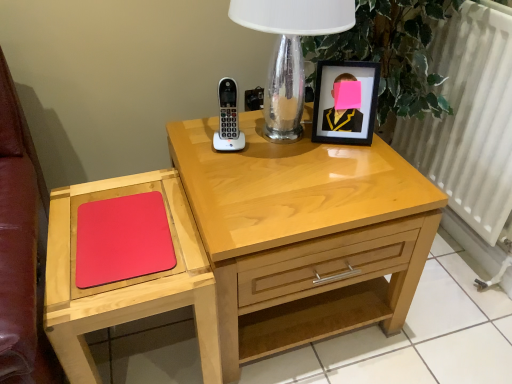
The width and height of the screenshot is (512, 384). In order to click on vacant space positioned to the left of white plastic phone at center in this screenshot , I will do `click(194, 142)`.